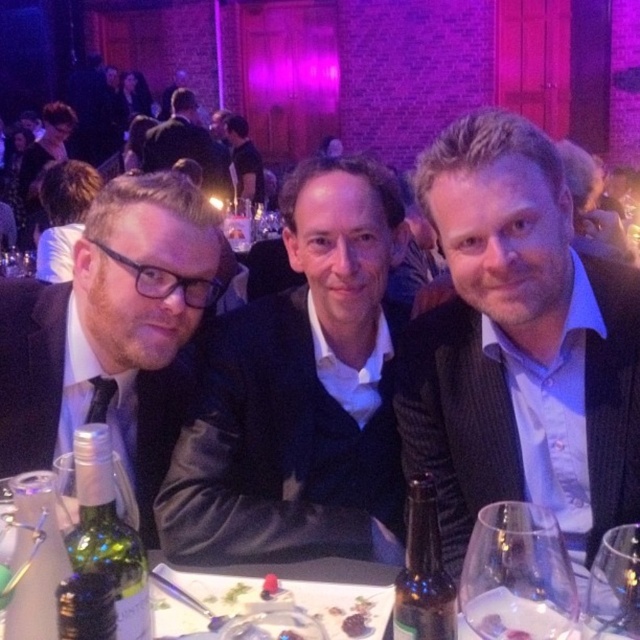
You are a waiter at a formal event and need to place a new wine glass on the table. The existing clear glass wine glass at lower right is already occupying the spot at point (516, 576). Is there enough space to place another wine glass next to it?

The clear glass wine glass at lower right is already at point (516, 576). Since the question does not provide information about the available space or distance from other objects, it is impossible to determine if there is enough space to place another wine glass next to it.

You are attending a formal event and need to place a new decorative item on the table. The table has a matte black jacket at center. Where should you place the item to ensure it doesn not overlap with the jacket?

The matte black jacket at center is located at point (300,392), so you should place the new decorative item away from that coordinate to avoid overlapping.